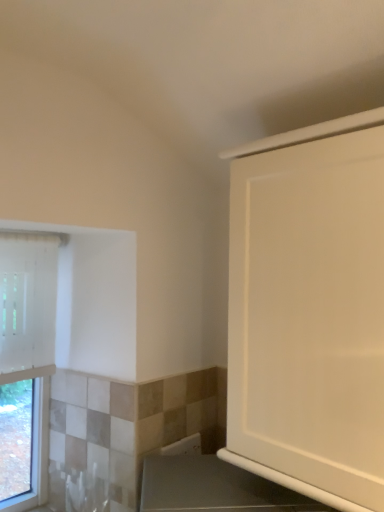
Question: Is white glossy cabinet at upper right outside white fabric window at left?

Choices:
 (A) no
 (B) yes

Answer: (B)

Question: Considering the relative sizes of white glossy cabinet at upper right and white fabric window at left in the image provided, is white glossy cabinet at upper right smaller than white fabric window at left?

Choices:
 (A) yes
 (B) no

Answer: (B)

Question: Can you confirm if white glossy cabinet at upper right is bigger than white fabric window at left?

Choices:
 (A) no
 (B) yes

Answer: (B)

Question: From the image's perspective, is white glossy cabinet at upper right on top of white fabric window at left?

Choices:
 (A) no
 (B) yes

Answer: (B)

Question: Considering the relative sizes of white glossy cabinet at upper right and white fabric window at left in the image provided, is white glossy cabinet at upper right shorter than white fabric window at left?

Choices:
 (A) yes
 (B) no

Answer: (A)

Question: Does white glossy cabinet at upper right touch white fabric window at left?

Choices:
 (A) no
 (B) yes

Answer: (A)

Question: Is white fabric window at left to the left of white glossy cabinet at upper right from the viewer's perspective?

Choices:
 (A) no
 (B) yes

Answer: (B)

Question: Is white fabric window at left far from white glossy cabinet at upper right?

Choices:
 (A) no
 (B) yes

Answer: (B)

Question: Is white fabric window at left positioned in front of white glossy cabinet at upper right?

Choices:
 (A) no
 (B) yes

Answer: (A)

Question: Is white fabric window at left further to camera compared to white glossy cabinet at upper right?

Choices:
 (A) yes
 (B) no

Answer: (A)

Question: Can we say white fabric window at left lies outside white glossy cabinet at upper right?

Choices:
 (A) yes
 (B) no

Answer: (A)

Question: From the image's perspective, is white fabric window at left under white glossy cabinet at upper right?

Choices:
 (A) no
 (B) yes

Answer: (B)

Question: From a real-world perspective, is white fabric window at left positioned above or below white glossy cabinet at upper right?

Choices:
 (A) above
 (B) below

Answer: (B)